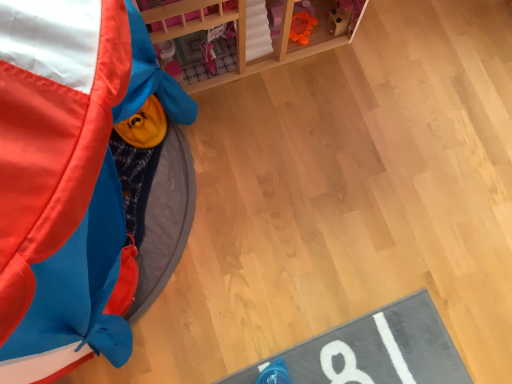
Find the location of a particular element. The image size is (512, 384). vacant area that is situated to the right of wooden dollhouse at upper center is located at coordinates (382, 78).